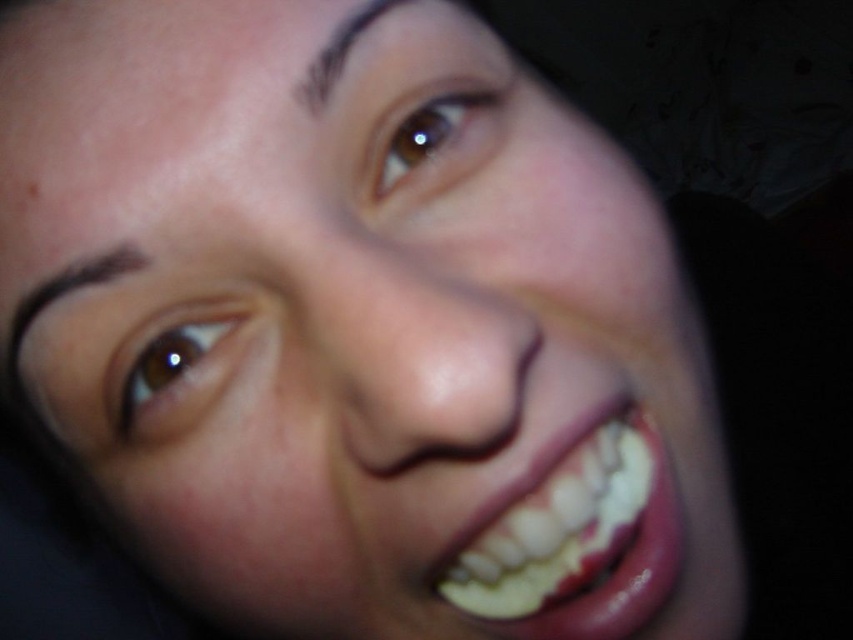
Question: From the image, what is the correct spatial relationship of brown shiny eye at upper center in relation to brown matte eyebrow at upper center?

Choices:
 (A) right
 (B) left

Answer: (A)

Question: Is brown matte eye at upper left positioned before brown shiny eye at upper center?

Choices:
 (A) no
 (B) yes

Answer: (B)

Question: Considering the real-world distances, which object is closest to the brown matte eye at upper left?

Choices:
 (A) brown matte eyebrow at upper center
 (B) shiny white teeth at lower right
 (C) brown shiny eye at upper center
 (D) brown matte eyebrow at upper left

Answer: (D)

Question: Is brown shiny eye at upper center bigger than brown matte eyebrow at upper center?

Choices:
 (A) yes
 (B) no

Answer: (A)

Question: Which point is closer to the camera?

Choices:
 (A) brown matte eyebrow at upper center
 (B) brown matte eye at upper left
 (C) shiny white teeth at lower right
 (D) brown shiny eye at upper center

Answer: (C)

Question: Which object appears closest to the camera in this image?

Choices:
 (A) brown matte eye at upper left
 (B) brown matte eyebrow at upper left
 (C) brown shiny eye at upper center
 (D) shiny white teeth at lower right

Answer: (D)